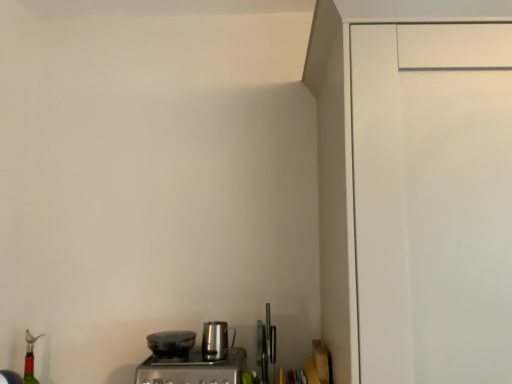
Question: Is shiny black pot at lower center, placed as the first kitchen appliance when sorted from left to right, spatially inside stainless steel kettle at center, which appears as the first kitchen appliance when viewed from the right, or outside of it?

Choices:
 (A) outside
 (B) inside

Answer: (A)

Question: Is shiny black pot at lower center, placed as the first kitchen appliance when sorted from left to right, to the left or to the right of stainless steel kettle at center, arranged as the 2th kitchen appliance when viewed from the left, in the image?

Choices:
 (A) left
 (B) right

Answer: (A)

Question: Estimate the real-world distances between objects in this image. Which object is closer to the shiny black pot at lower center, placed as the first kitchen appliance when sorted from left to right?

Choices:
 (A) stainless steel coffee maker at lower center
 (B) stainless steel kettle at center, arranged as the 2th kitchen appliance when viewed from the left
 (C) translucent red glass bottle at lower left

Answer: (A)

Question: Considering the real-world distances, which object is closest to the translucent red glass bottle at lower left?

Choices:
 (A) shiny black pot at lower center, placed as the first kitchen appliance when sorted from left to right
 (B) stainless steel kettle at center, which appears as the first kitchen appliance when viewed from the right
 (C) stainless steel coffee maker at lower center

Answer: (A)